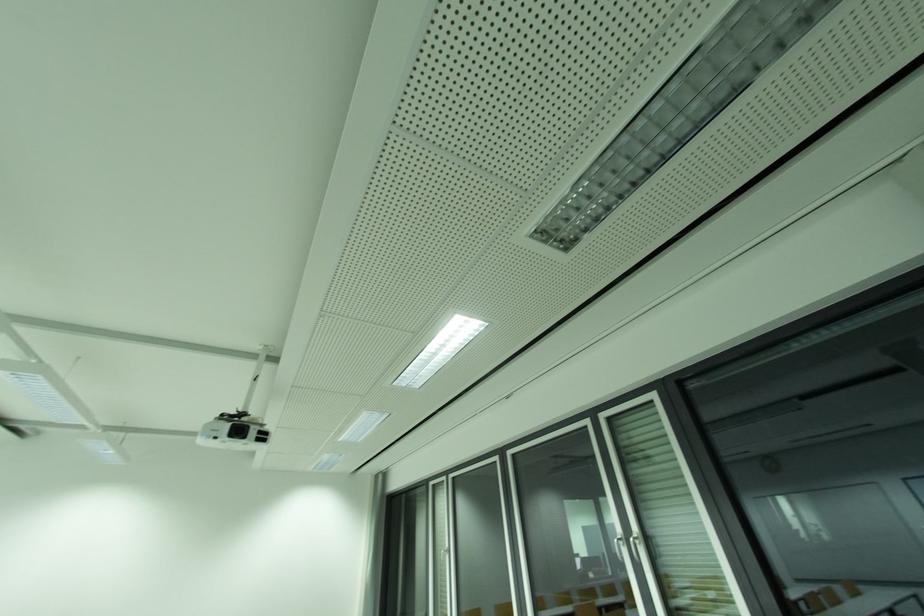
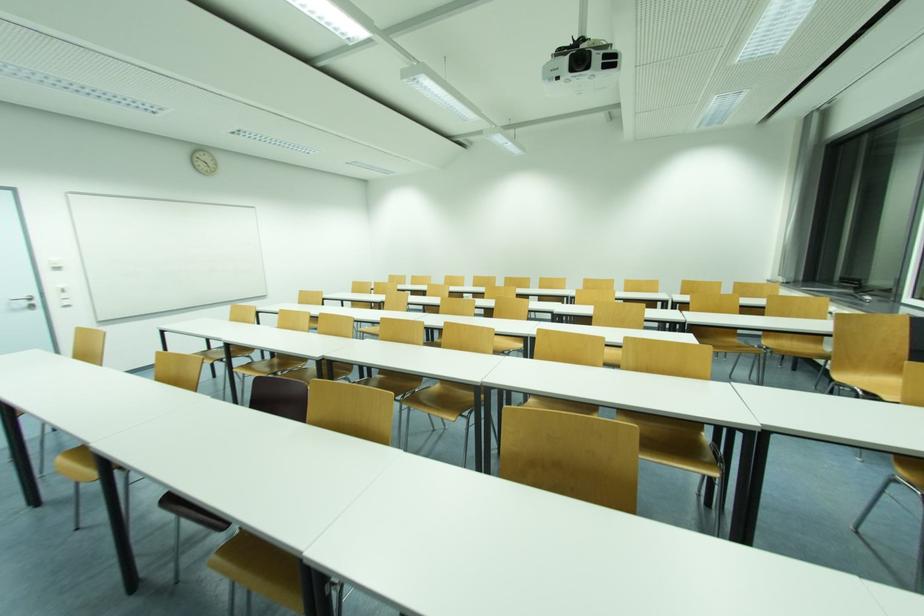
The images are taken continuously from a first-person perspective. In which direction is your viewpoint rotating?

The camera rotated toward left-down.